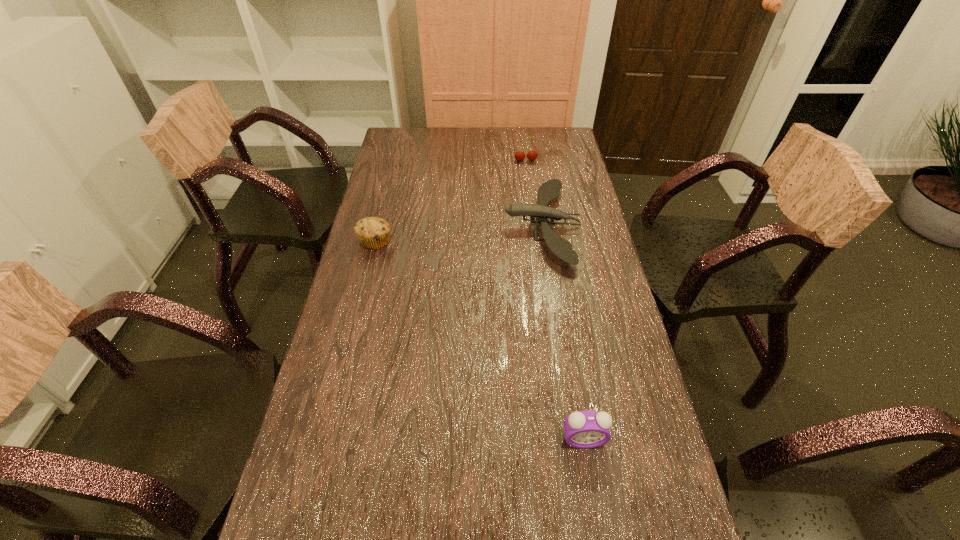
Find the location of `cherry`. cherry is located at coordinates (531, 155).

Find the location of a particular element. The width and height of the screenshot is (960, 540). alarm clock is located at coordinates (586, 429).

I want to click on muffin, so click(x=373, y=233).

The image size is (960, 540). I want to click on drone, so click(x=549, y=190).

What are the coordinates of `vacant area located on the surface of the cherry` in the screenshot? It's located at (527, 172).

Find the location of `free point located 0.140m on the face of the alarm clock`. free point located 0.140m on the face of the alarm clock is located at coordinates 596,519.

The height and width of the screenshot is (540, 960). Find the location of `vacant space situated on the right of the muffin`. vacant space situated on the right of the muffin is located at coordinates (438, 241).

Where is `free region located 0.200m at the head of the drone`? The width and height of the screenshot is (960, 540). free region located 0.200m at the head of the drone is located at coordinates (445, 226).

This screenshot has width=960, height=540. What are the coordinates of `free space located 0.340m at the head of the drone` in the screenshot? It's located at (404, 226).

What are the coordinates of `vacant space positioned at the head of the drone` in the screenshot? It's located at (467, 226).